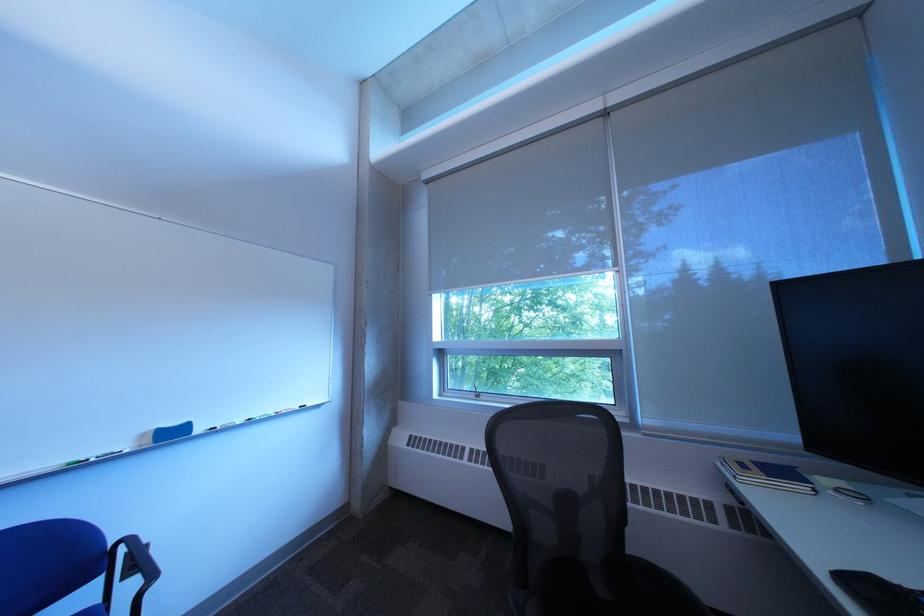
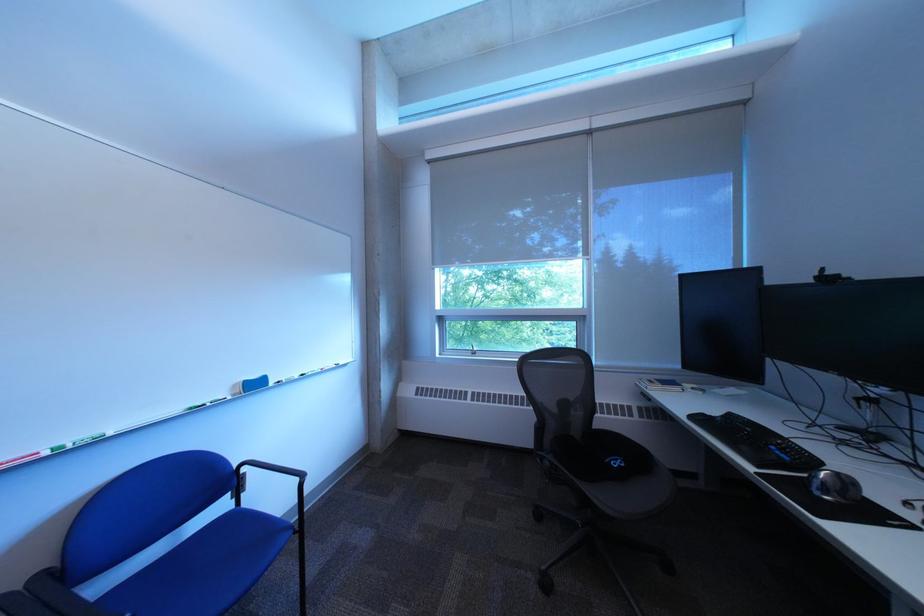
Where in the second image is the point corresponding to the point at 135,544 from the first image?

(257, 467)